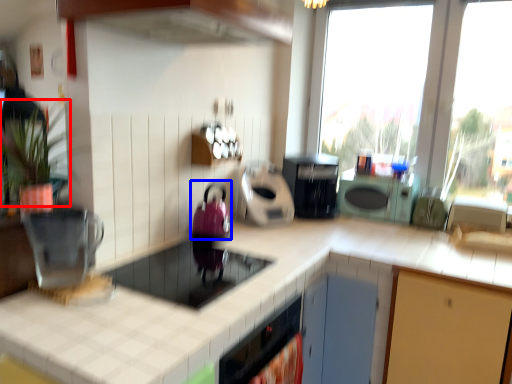
Question: Which object appears closest to the camera in this image, plant (highlighted by a red box) or appliance (highlighted by a blue box)?

Choices:
 (A) plant
 (B) appliance

Answer: (A)